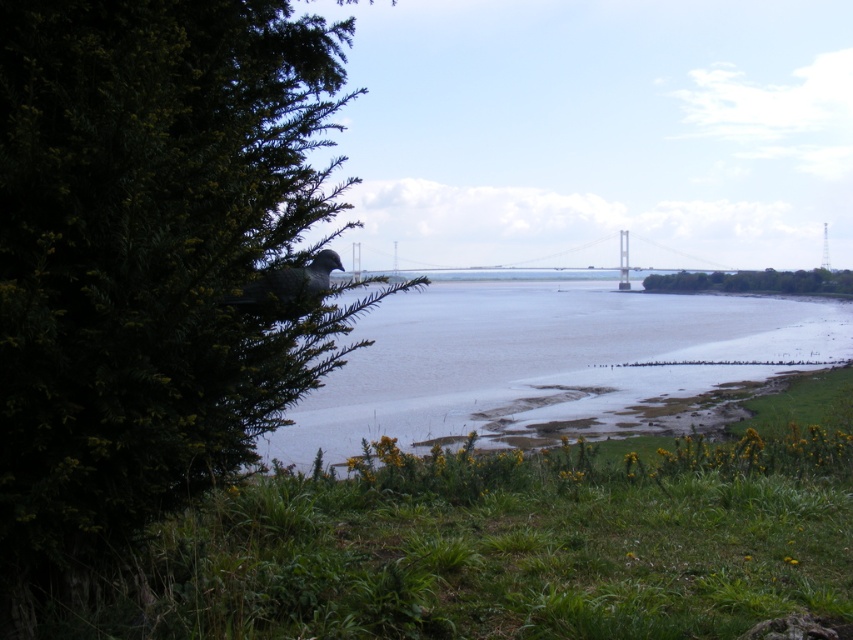
What do you see at coordinates (531, 269) in the screenshot? I see `white concrete bridge at center` at bounding box center [531, 269].

Is point (471, 273) positioned behind point (830, 291)?

Yes, it is.

Who is more forward, (537, 266) or (683, 275)?

Positioned in front is point (683, 275).

Identify the location of white concrete bridge at center. This screenshot has width=853, height=640. (531, 269).

Who is more forward, (x=45, y=35) or (x=355, y=442)?

Positioned in front is point (x=45, y=35).

Find the location of `green leafy tree at left`. green leafy tree at left is located at coordinates [151, 268].

Can you confirm if green leafy tree at left is shorter than white concrete bridge at center?

Incorrect, green leafy tree at left's height does not fall short of white concrete bridge at center's.

Between green leafy tree at left and white concrete bridge at center, which one is positioned lower?

white concrete bridge at center is lower down.

This screenshot has width=853, height=640. I want to click on green leafy tree at left, so click(151, 268).